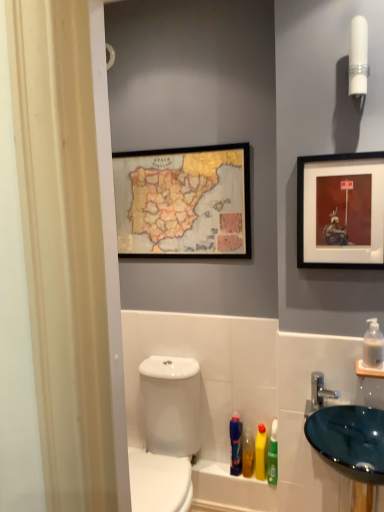
Question: In terms of size, does yellow matte bottle at lower center appear bigger or smaller than matte black picture frame at upper right, acting as the second picture frame starting from the back?

Choices:
 (A) big
 (B) small

Answer: (B)

Question: Is point (261, 448) closer or farther from the camera than point (327, 252)?

Choices:
 (A) closer
 (B) farther

Answer: (B)

Question: Which object is positioned farthest from the yellow matte bottle at lower center?

Choices:
 (A) silver metallic faucet at lower right
 (B) white glossy toilet at lower left
 (C) white plastic tube at upper right
 (D) matte black picture frame at upper right, which is the first picture frame from right to left
 (E) clear plastic pump at right, positioned as the 1th mouthwash in right-to-left order

Answer: (C)

Question: Which of these objects is positioned farthest from the white glossy toilet at lower left?

Choices:
 (A) glossy glass sink at lower right
 (B) white plastic tube at upper right
 (C) translucent plastic mouthwash at lower right, acting as the first mouthwash starting from the bottom
 (D) translucent green mouthwash at lower right, acting as the first mouthwash starting from the left
 (E) yellow matte bottle at lower center

Answer: (B)